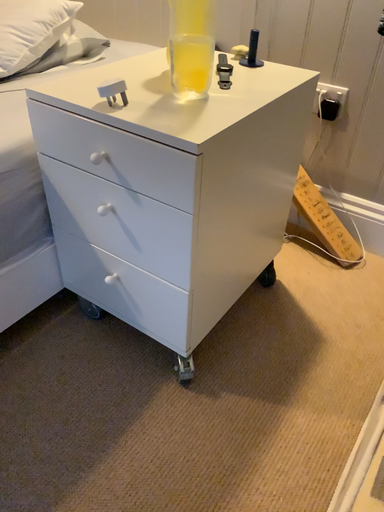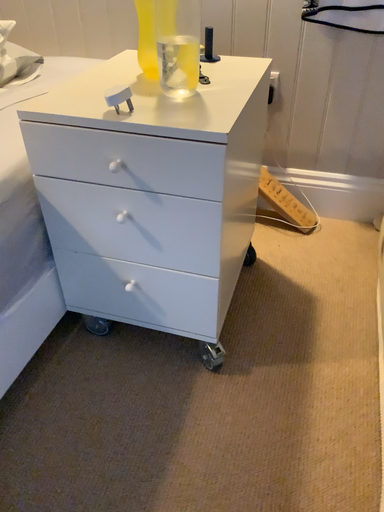
Question: Which way did the camera rotate in the video?

Choices:
 (A) rotated left
 (B) rotated right

Answer: (B)